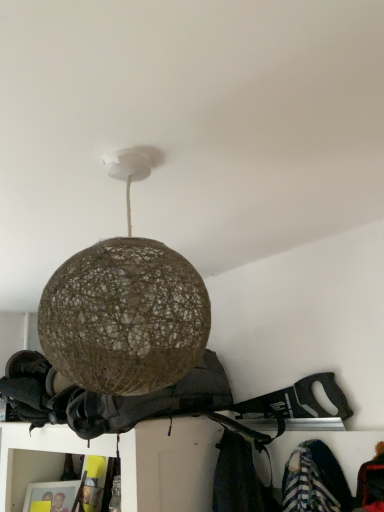
You are a GUI agent. You are given a task and a screenshot of the screen. Output one action in this format:
    pyautogui.click(x=<x>, y=<y>)
    Task: Click on the brown woven ball at center
    
    Given the screenshot: What is the action you would take?
    pyautogui.click(x=109, y=398)

This screenshot has width=384, height=512. What do you see at coordinates (109, 398) in the screenshot?
I see `brown woven ball at center` at bounding box center [109, 398].

What is the approximate height of brown woven sphere at center?

It is 15.72 inches.

What do you see at coordinates (125, 307) in the screenshot? The height and width of the screenshot is (512, 384). I see `brown woven sphere at center` at bounding box center [125, 307].

This screenshot has width=384, height=512. In order to click on brown woven sphere at center in this screenshot , I will do `click(125, 307)`.

Where is `brown woven ball at center`? This screenshot has height=512, width=384. brown woven ball at center is located at coordinates (109, 398).

Based on the photo, which is more to the right, brown woven sphere at center or brown woven ball at center?

brown woven sphere at center.

Is brown woven sphere at center positioned behind brown woven ball at center?

No, it is not.

Does point (190, 349) come in front of point (222, 368)?

Yes, point (190, 349) is closer to viewer.

From the image's perspective, which is above, brown woven sphere at center or brown woven ball at center?

brown woven sphere at center.

From a real-world perspective, is brown woven sphere at center physically below brown woven ball at center?

No, from a real-world perspective, brown woven sphere at center is not beneath brown woven ball at center.

Considering the sizes of brown woven sphere at center and brown woven ball at center in the image, is brown woven sphere at center wider or thinner than brown woven ball at center?

Considering their sizes, brown woven sphere at center looks slimmer than brown woven ball at center.

Considering the relative sizes of brown woven sphere at center and brown woven ball at center in the image provided, is brown woven sphere at center shorter than brown woven ball at center?

No.

Considering the sizes of objects brown woven sphere at center and brown woven ball at center in the image provided, who is smaller, brown woven sphere at center or brown woven ball at center?

brown woven sphere at center is smaller.

Can brown woven ball at center be found inside brown woven sphere at center?

Definitely not — brown woven ball at center is not inside brown woven sphere at center.

Based on the photo, is brown woven sphere at center beside brown woven ball at center?

No.

Is brown woven sphere at center turned away from brown woven ball at center?

brown woven sphere at center is not turned away from brown woven ball at center.

Measure the distance from brown woven sphere at center to brown woven ball at center.

They are 20.90 inches apart.

Find the location of `clothing directly beneath the brown woven sphere at center (from a real-world perspective)`. clothing directly beneath the brown woven sphere at center (from a real-world perspective) is located at coordinates (x=109, y=398).

Can you confirm if brown woven ball at center is positioned to the right of brown woven sphere at center?

Incorrect, brown woven ball at center is not on the right side of brown woven sphere at center.

Is brown woven ball at center in front of or behind brown woven sphere at center in the image?

Clearly, brown woven ball at center is behind brown woven sphere at center.

Is point (105, 422) less distant than point (171, 376)?

That is False.

From the image's perspective, between brown woven ball at center and brown woven sphere at center, who is located below?

brown woven ball at center appears lower in the image.

From a real-world perspective, between brown woven ball at center and brown woven sphere at center, who is vertically higher?

brown woven sphere at center.

Does brown woven ball at center have a greater width compared to brown woven sphere at center?

Indeed, brown woven ball at center has a greater width compared to brown woven sphere at center.

Considering the sizes of brown woven ball at center and brown woven sphere at center in the image, is brown woven ball at center taller or shorter than brown woven sphere at center?

Considering their sizes, brown woven ball at center has less height than brown woven sphere at center.

Looking at this image, can you confirm if brown woven ball at center is bigger than brown woven sphere at center?

Yes, brown woven ball at center is bigger than brown woven sphere at center.

Based on the photo, would you say brown woven ball at center is inside or outside brown woven sphere at center?

brown woven ball at center is located beyond the bounds of brown woven sphere at center.

Would you say brown woven ball at center is a long distance from brown woven sphere at center?

No, brown woven ball at center is in close proximity to brown woven sphere at center.

Does brown woven ball at center turn towards brown woven sphere at center?

No.

What are the coordinates of `lamp that appears in front of the brown woven ball at center` in the screenshot? It's located at (125, 307).

Locate an element on the screen. This screenshot has width=384, height=512. lamp above the brown woven ball at center (from the image's perspective) is located at coordinates pyautogui.click(x=125, y=307).

Locate an element on the screen. The height and width of the screenshot is (512, 384). lamp that is above the brown woven ball at center (from a real-world perspective) is located at coordinates (125, 307).